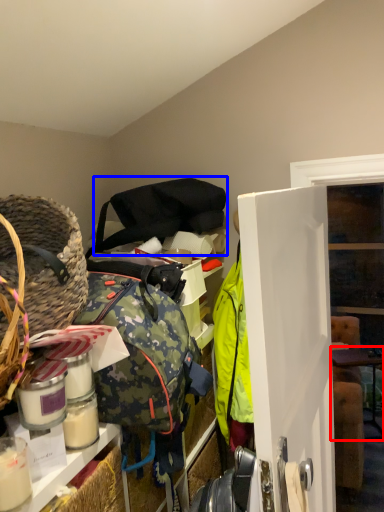
Question: Which object appears closest to the camera in this image, table (highlighted by a red box) or shoulder bag (highlighted by a blue box)?

Choices:
 (A) table
 (B) shoulder bag

Answer: (B)